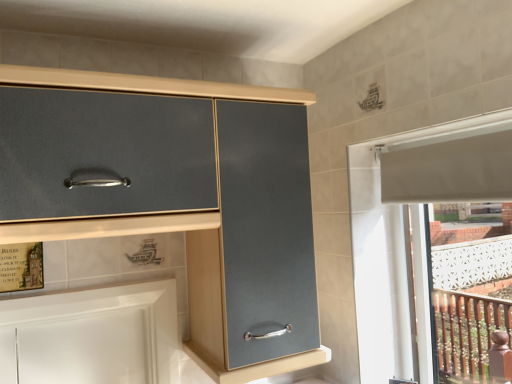
Question: Considering the positions of matte gray cabinet at center, the 1th cabinetry viewed from the top, and white glossy cabinet at lower left, which is the first cabinetry from bottom to top, in the image, is matte gray cabinet at center, the 1th cabinetry viewed from the top, wider or thinner than white glossy cabinet at lower left, which is the first cabinetry from bottom to top,?

Choices:
 (A) thin
 (B) wide

Answer: (B)

Question: Choose the correct answer: Is matte gray cabinet at center, the 1th cabinetry viewed from the top, inside white glossy cabinet at lower left, the 2th cabinetry when ordered from top to bottom, or outside it?

Choices:
 (A) inside
 (B) outside

Answer: (B)

Question: In the image, is matte gray cabinet at center, the 1th cabinetry viewed from the top, positioned in front of or behind white glossy cabinet at lower left, which is the first cabinetry from bottom to top?

Choices:
 (A) behind
 (B) front

Answer: (B)

Question: From a real-world perspective, is white glossy cabinet at lower left, which is the first cabinetry from bottom to top, positioned above or below matte gray cabinet at center, the 1th cabinetry viewed from the top?

Choices:
 (A) below
 (B) above

Answer: (A)

Question: Is point (53, 311) closer or farther from the camera than point (38, 76)?

Choices:
 (A) closer
 (B) farther

Answer: (B)

Question: Is white glossy cabinet at lower left, the 2th cabinetry when ordered from top to bottom, inside or outside of matte gray cabinet at center, the 1th cabinetry viewed from the top?

Choices:
 (A) outside
 (B) inside

Answer: (A)

Question: Relative to matte gray cabinet at center, the 1th cabinetry viewed from the top, is white glossy cabinet at lower left, which is the first cabinetry from bottom to top, in front or behind?

Choices:
 (A) front
 (B) behind

Answer: (B)